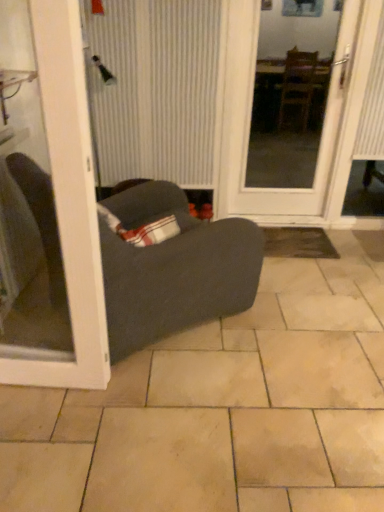
At what (x,y) coordinates should I click in order to perform the action: click on free space in front of dark gray fabric studio couch at center. Please return your answer as a coordinate pair (x, y). Looking at the image, I should click on (168, 424).